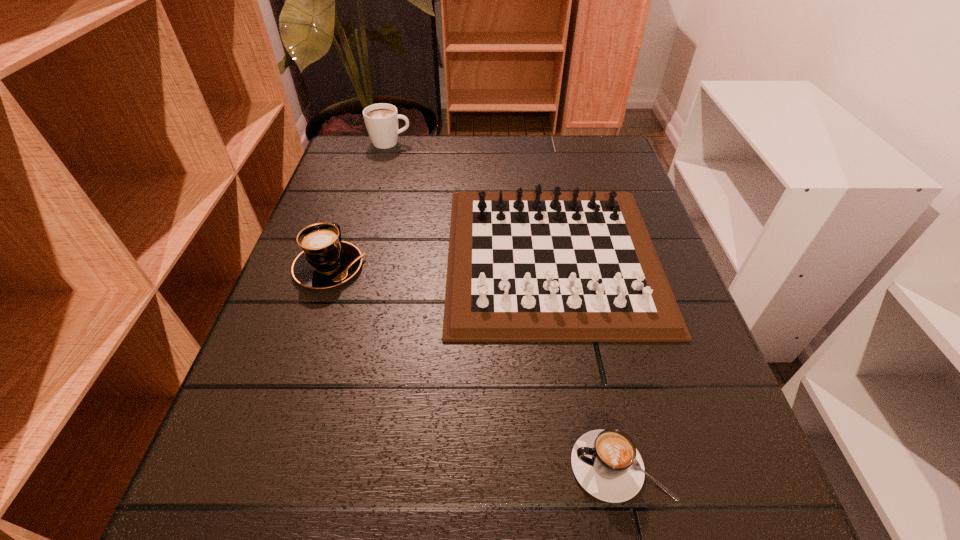
Where is `unoccupied area between the gameboard and the nearest cappuccino`? This screenshot has height=540, width=960. unoccupied area between the gameboard and the nearest cappuccino is located at coordinates (587, 361).

I want to click on vacant area that lies between the second farthest cappuccino and the farthest cappuccino, so click(x=360, y=205).

The height and width of the screenshot is (540, 960). Identify the location of object that can be found as the third closest to the second nearest cappuccino. (606, 463).

Choose which object is the third nearest neighbor to the nearest cappuccino. Please provide its 2D coordinates. Your answer should be formatted as a tuple, i.e. [(x, y)], where the tuple contains the x and y coordinates of a point satisfying the conditions above.

[(381, 120)]

What are the coordinates of `the second closest cappuccino to the gameboard` in the screenshot? It's located at (326, 261).

Where is `cappuccino that is the closest to the farthest object`? cappuccino that is the closest to the farthest object is located at coordinates (326, 261).

Where is `vacant region that satisfies the following two spatial constraints: 1. with the handle on the side of the farthest cappuccino; 2. on the left side of the gameboard`? vacant region that satisfies the following two spatial constraints: 1. with the handle on the side of the farthest cappuccino; 2. on the left side of the gameboard is located at coordinates (358, 256).